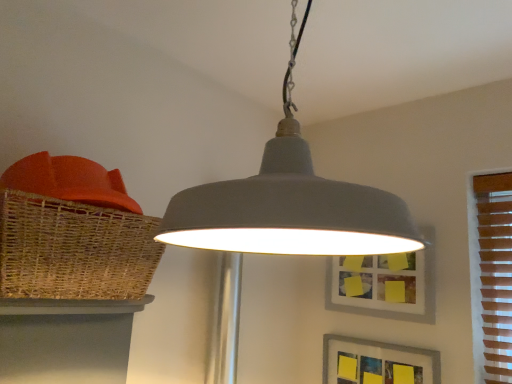
This screenshot has width=512, height=384. Describe the element at coordinates (74, 250) in the screenshot. I see `woven brown basket at left` at that location.

Locate an element on the screen. This screenshot has width=512, height=384. matte gray picture frame at lower right, the second picture frame when ordered from top to bottom is located at coordinates [x=377, y=362].

This screenshot has height=384, width=512. I want to click on matte gray picture frame at center, the second picture frame in the bottom-to-top sequence, so click(x=378, y=286).

What do you see at coordinates (289, 203) in the screenshot? Image resolution: width=512 pixels, height=384 pixels. I see `matte gray pendant light at center` at bounding box center [289, 203].

This screenshot has width=512, height=384. Identify the location of woven brown basket at left. (74, 250).

From the image's perspective, is matte wicker table at lower left on matte gray pendant light at center?

No.

Would you say matte wicker table at lower left is outside matte gray pendant light at center?

Yes, matte wicker table at lower left is not within matte gray pendant light at center.

You are a GUI agent. You are given a task and a screenshot of the screen. Output one action in this format:
    pyautogui.click(x=<x>, y=<y>)
    Task: Click on the lamp in front of the matte wicker table at lower left
    The width and height of the screenshot is (512, 384).
    Given the screenshot: What is the action you would take?
    coord(289,203)

Between matte wicker table at lower left and matte gray pendant light at center, which one appears on the left side from the viewer's perspective?

matte wicker table at lower left is more to the left.

Is matte gray picture frame at lower right, the second picture frame when ordered from top to bottom, taller or shorter than matte gray picture frame at center, the second picture frame in the bottom-to-top sequence?

Clearly, matte gray picture frame at lower right, the second picture frame when ordered from top to bottom, is shorter compared to matte gray picture frame at center, the second picture frame in the bottom-to-top sequence.

Locate an element on the screen. The width and height of the screenshot is (512, 384). picture frame that is in front of the matte gray picture frame at center, the 1th picture frame from the top is located at coordinates (377, 362).

Could you measure the distance between matte gray picture frame at lower right, the second picture frame when ordered from top to bottom, and matte gray picture frame at center, the second picture frame in the bottom-to-top sequence?

The distance of matte gray picture frame at lower right, the second picture frame when ordered from top to bottom, from matte gray picture frame at center, the second picture frame in the bottom-to-top sequence, is 7.79 inches.

From a real-world perspective, which is physically above, matte gray picture frame at lower right, positioned as the first picture frame in bottom-to-top order, or matte gray picture frame at center, the 1th picture frame from the top?

matte gray picture frame at center, the 1th picture frame from the top.

In the scene shown: Considering the sizes of objects matte gray picture frame at center, the second picture frame in the bottom-to-top sequence, and matte gray picture frame at lower right, positioned as the first picture frame in bottom-to-top order, in the image provided, who is smaller, matte gray picture frame at center, the second picture frame in the bottom-to-top sequence, or matte gray picture frame at lower right, positioned as the first picture frame in bottom-to-top order,?

With smaller size is matte gray picture frame at lower right, positioned as the first picture frame in bottom-to-top order.

Considering their positions, is matte gray picture frame at center, the 1th picture frame from the top, located in front of or behind matte gray picture frame at lower right, positioned as the first picture frame in bottom-to-top order?

matte gray picture frame at center, the 1th picture frame from the top, is behind matte gray picture frame at lower right, positioned as the first picture frame in bottom-to-top order.

You are a GUI agent. You are given a task and a screenshot of the screen. Output one action in this format:
    pyautogui.click(x=<x>, y=<y>)
    Task: Click on the picture frame on the left of matte gray picture frame at center, the 1th picture frame from the top
    The height and width of the screenshot is (384, 512).
    Given the screenshot: What is the action you would take?
    pyautogui.click(x=377, y=362)

From a real-world perspective, who is located higher, matte gray picture frame at center, the second picture frame in the bottom-to-top sequence, or matte gray picture frame at lower right, positioned as the first picture frame in bottom-to-top order?

matte gray picture frame at center, the second picture frame in the bottom-to-top sequence, is physically above.

Which object is positioned more to the right, matte wicker table at lower left or woven brown basket at left?

woven brown basket at left.

Can you confirm if matte wicker table at lower left is bigger than woven brown basket at left?

No.

Does point (75, 365) come farther from viewer compared to point (31, 218)?

Yes, point (75, 365) is behind point (31, 218).

Would you say woven brown basket at left is part of matte wicker table at lower left's contents?

No, woven brown basket at left is located outside of matte wicker table at lower left.

From the image's perspective, is matte gray pendant light at center over matte gray picture frame at lower right, positioned as the first picture frame in bottom-to-top order?

Yes, from the image's perspective, matte gray pendant light at center is over matte gray picture frame at lower right, positioned as the first picture frame in bottom-to-top order.

From a real-world perspective, is matte gray pendant light at center above or below matte gray picture frame at lower right, the second picture frame when ordered from top to bottom?

matte gray pendant light at center is above matte gray picture frame at lower right, the second picture frame when ordered from top to bottom.

Could you measure the distance between matte gray pendant light at center and matte gray picture frame at lower right, positioned as the first picture frame in bottom-to-top order?

matte gray pendant light at center and matte gray picture frame at lower right, positioned as the first picture frame in bottom-to-top order, are 3.46 feet apart from each other.

Which object is thinner, matte gray pendant light at center or matte gray picture frame at lower right, positioned as the first picture frame in bottom-to-top order?

With smaller width is matte gray picture frame at lower right, positioned as the first picture frame in bottom-to-top order.

Is matte gray picture frame at lower right, positioned as the first picture frame in bottom-to-top order, positioned far away from woven brown basket at left?

Yes, matte gray picture frame at lower right, positioned as the first picture frame in bottom-to-top order, is far from woven brown basket at left.

Is matte gray picture frame at lower right, the second picture frame when ordered from top to bottom, surrounding woven brown basket at left?

No, woven brown basket at left is not inside matte gray picture frame at lower right, the second picture frame when ordered from top to bottom.

What's the angular difference between matte gray picture frame at lower right, the second picture frame when ordered from top to bottom, and woven brown basket at left's facing directions?

90 degrees.

Image resolution: width=512 pixels, height=384 pixels. Identify the location of picture frame that is the 1st object located behind the woven brown basket at left. (377, 362).

Is matte gray pendant light at center positioned far away from woven brown basket at left?

No, there isn't a large distance between matte gray pendant light at center and woven brown basket at left.

From a real-world perspective, is matte gray pendant light at center positioned over woven brown basket at left based on gravity?

Indeed, from a real-world perspective, matte gray pendant light at center stands above woven brown basket at left.

Measure the distance from matte gray pendant light at center to woven brown basket at left.

matte gray pendant light at center is 14.30 inches away from woven brown basket at left.

Which object is positioned more to the right, matte gray pendant light at center or woven brown basket at left?

matte gray pendant light at center.

The width and height of the screenshot is (512, 384). In the image, there is a matte gray pendant light at center. In order to click on table below it (from a real-world perspective) in this screenshot , I will do `click(66, 340)`.

At what (x,y) coordinates should I click in order to perform the action: click on picture frame on the left of matte gray picture frame at center, the second picture frame in the bottom-to-top sequence. Please return your answer as a coordinate pair (x, y). This screenshot has height=384, width=512. Looking at the image, I should click on (377, 362).

When comparing their distances from matte gray picture frame at lower right, positioned as the first picture frame in bottom-to-top order, does matte gray picture frame at center, the second picture frame in the bottom-to-top sequence, or matte wicker table at lower left seem further?

matte wicker table at lower left is further to matte gray picture frame at lower right, positioned as the first picture frame in bottom-to-top order.

Considering their positions, is matte gray picture frame at lower right, positioned as the first picture frame in bottom-to-top order, positioned further to matte wicker table at lower left than matte gray pendant light at center?

Based on the image, matte gray picture frame at lower right, positioned as the first picture frame in bottom-to-top order, appears to be further to matte wicker table at lower left.

Estimate the real-world distances between objects in this image. Which object is closer to woven brown basket at left, matte wicker table at lower left or matte gray picture frame at center, the second picture frame in the bottom-to-top sequence?

The object closer to woven brown basket at left is matte wicker table at lower left.

Considering their positions, is matte gray pendant light at center positioned closer to woven brown basket at left than matte wicker table at lower left?

matte wicker table at lower left lies closer to woven brown basket at left than the other object.

Looking at the image, which one is located closer to woven brown basket at left, matte gray picture frame at center, the 1th picture frame from the top, or matte gray picture frame at lower right, the second picture frame when ordered from top to bottom?

matte gray picture frame at center, the 1th picture frame from the top, is positioned closer to the anchor woven brown basket at left.

Looking at the image, which one is located further to matte gray picture frame at center, the 1th picture frame from the top, matte wicker table at lower left or woven brown basket at left?

woven brown basket at left.

When comparing their distances from matte gray picture frame at center, the 1th picture frame from the top, does matte gray picture frame at lower right, positioned as the first picture frame in bottom-to-top order, or matte gray pendant light at center seem further?

Among the two, matte gray pendant light at center is located further to matte gray picture frame at center, the 1th picture frame from the top.

Considering their positions, is woven brown basket at left positioned further to matte wicker table at lower left than matte gray picture frame at lower right, the second picture frame when ordered from top to bottom?

matte gray picture frame at lower right, the second picture frame when ordered from top to bottom, is positioned further to the anchor matte wicker table at lower left.

Locate an element on the screen. The height and width of the screenshot is (384, 512). basket between matte gray pendant light at center and matte gray picture frame at lower right, positioned as the first picture frame in bottom-to-top order, along the z-axis is located at coordinates (74, 250).

Identify the location of basket between matte wicker table at lower left and matte gray picture frame at lower right, positioned as the first picture frame in bottom-to-top order, in the horizontal direction. (74, 250).

Image resolution: width=512 pixels, height=384 pixels. Identify the location of basket positioned between matte gray pendant light at center and matte gray picture frame at center, the 1th picture frame from the top, from near to far. (74, 250).

This screenshot has height=384, width=512. Identify the location of table between matte gray pendant light at center and matte gray picture frame at center, the 1th picture frame from the top, along the z-axis. (66, 340).